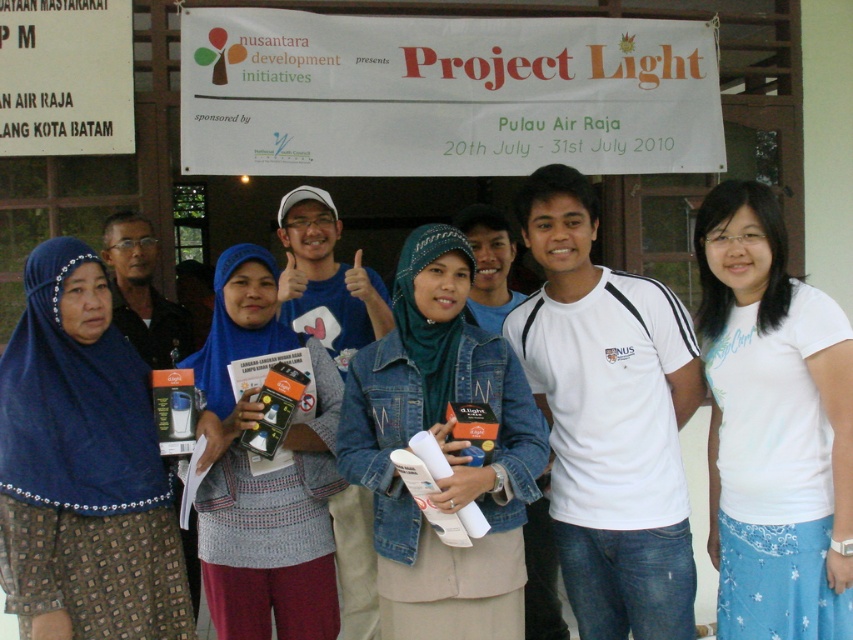
Is the position of white cotton t-shirt at center less distant than that of denim jacket at center?

No, white cotton t-shirt at center is behind denim jacket at center.

You are a GUI agent. You are given a task and a screenshot of the screen. Output one action in this format:
    pyautogui.click(x=<x>, y=<y>)
    Task: Click on the white cotton t-shirt at center
    The width and height of the screenshot is (853, 640).
    Given the screenshot: What is the action you would take?
    pyautogui.click(x=773, y=426)

Is point (824, 592) positioned after point (483, 614)?

No, (824, 592) is in front of (483, 614).

Locate an element on the screen. The image size is (853, 640). white cotton t-shirt at center is located at coordinates (773, 426).

From the picture: Is blue fabric hijab at center taller than denim jacket at center?

In fact, blue fabric hijab at center may be shorter than denim jacket at center.

Which of these two, blue fabric hijab at center or denim jacket at center, stands taller?

Standing taller between the two is denim jacket at center.

Is point (97, 621) farther from camera compared to point (390, 376)?

No, it is in front of (390, 376).

Locate an element on the screen. blue fabric hijab at center is located at coordinates (83, 465).

Looking at this image, is white cotton t-shirt at center closer to the viewer compared to blue fabric hijab at center?

No.

From the picture: Which is more to the right, white cotton t-shirt at center or blue fabric hijab at center?

white cotton t-shirt at center

What are the coordinates of `white cotton t-shirt at center` in the screenshot? It's located at (773, 426).

The image size is (853, 640). I want to click on white cotton t-shirt at center, so click(x=773, y=426).